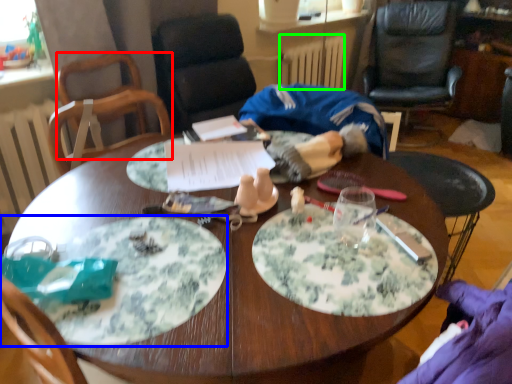
Question: Considering the real-world distances, which object is closest to chair (highlighted by a red box)? plate (highlighted by a blue box) or radiator (highlighted by a green box).

Choices:
 (A) plate
 (B) radiator

Answer: (A)